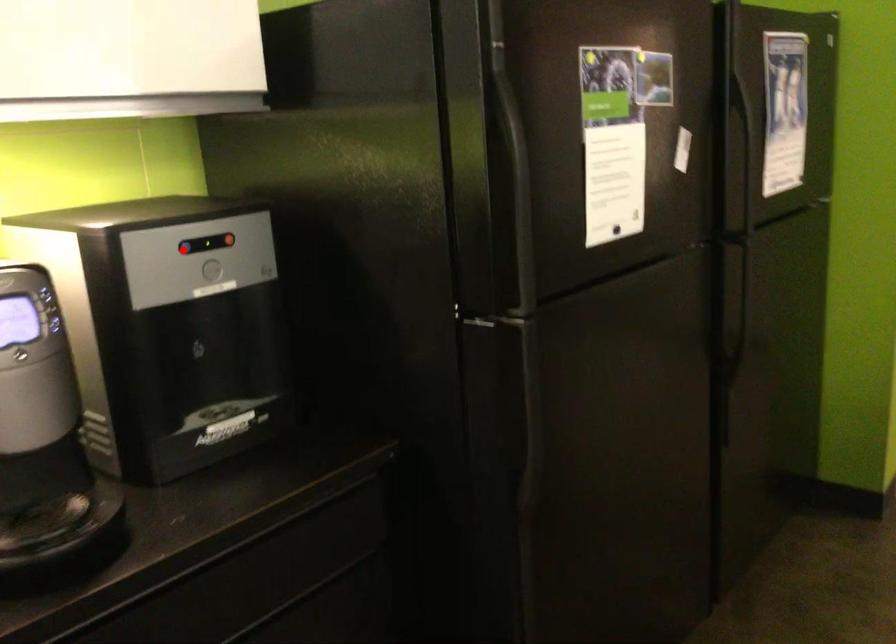
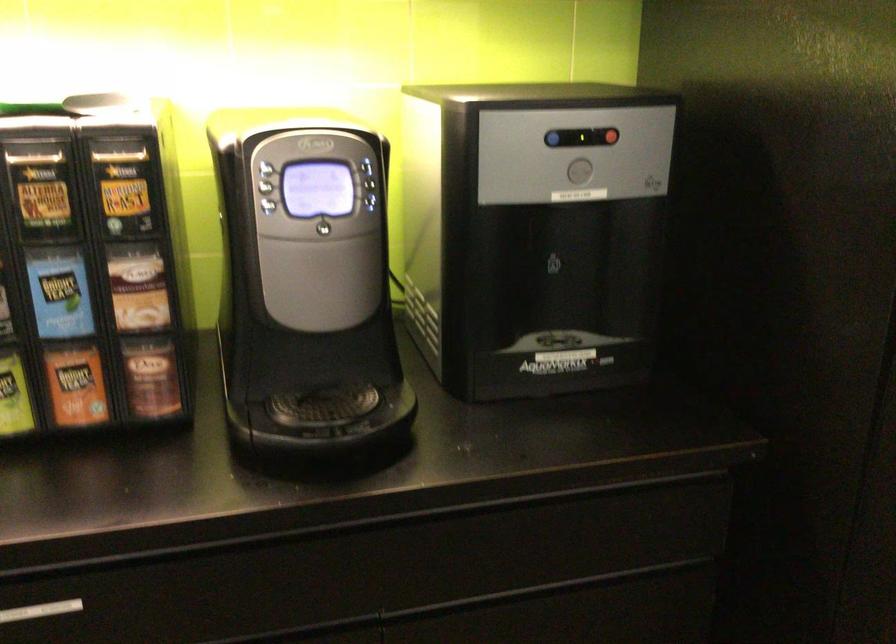
Question: I am providing you with two images of the same scene from different viewpoints. Image1 has a red point marked. In image2, the corresponding 3D location appears at what relative position? Reply with the corresponding letter.

Choices:
 (A) Closer
 (B) Farther

Answer: (A)